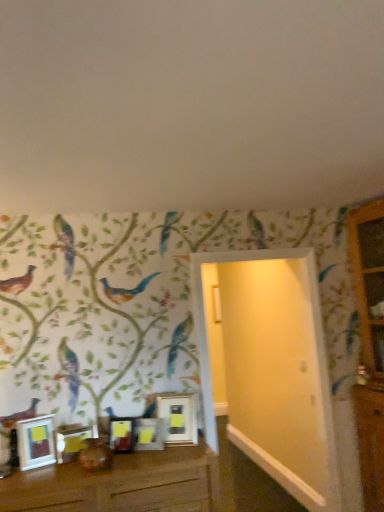
Question: Which direction should I rotate to look at metallic silver picture frame at center, the 1th picture frame viewed from the right, — up or down?

Choices:
 (A) down
 (B) up

Answer: (A)

Question: From a real-world perspective, does white glossy picture frame at lower left, acting as the 5th picture frame starting from the right, sit lower than matte brown vase at center?

Choices:
 (A) yes
 (B) no

Answer: (B)

Question: Considering the relative sizes of white glossy picture frame at lower left, the 1th picture frame positioned from the left, and matte brown vase at center in the image provided, is white glossy picture frame at lower left, the 1th picture frame positioned from the left, bigger than matte brown vase at center?

Choices:
 (A) yes
 (B) no

Answer: (A)

Question: Considering the relative sizes of white glossy picture frame at lower left, acting as the 5th picture frame starting from the right, and matte brown vase at center in the image provided, is white glossy picture frame at lower left, acting as the 5th picture frame starting from the right, smaller than matte brown vase at center?

Choices:
 (A) no
 (B) yes

Answer: (A)

Question: From the image's perspective, is white glossy picture frame at lower left, the 1th picture frame positioned from the left, below matte brown vase at center?

Choices:
 (A) yes
 (B) no

Answer: (B)

Question: Is matte brown vase at center at the back of white glossy picture frame at lower left, the 1th picture frame positioned from the left?

Choices:
 (A) no
 (B) yes

Answer: (A)

Question: Is white glossy picture frame at lower left, the 1th picture frame positioned from the left, not within matte brown vase at center?

Choices:
 (A) yes
 (B) no

Answer: (A)

Question: Considering the relative sizes of matte silver picture frame at center, which is the 3th picture frame in right-to-left order, and metallic silver frame at center, which ranks as the 4th picture frame in left-to-right order, in the image provided, is matte silver picture frame at center, which is the 3th picture frame in right-to-left order, smaller than metallic silver frame at center, which ranks as the 4th picture frame in left-to-right order,?

Choices:
 (A) yes
 (B) no

Answer: (B)

Question: Considering the relative positions of matte silver picture frame at center, arranged as the 3th picture frame when viewed from the left, and metallic silver frame at center, which ranks as the 4th picture frame in left-to-right order, in the image provided, is matte silver picture frame at center, arranged as the 3th picture frame when viewed from the left, to the right of metallic silver frame at center, which ranks as the 4th picture frame in left-to-right order, from the viewer's perspective?

Choices:
 (A) no
 (B) yes

Answer: (A)

Question: Is matte silver picture frame at center, arranged as the 3th picture frame when viewed from the left, located outside metallic silver frame at center, which ranks as the 4th picture frame in left-to-right order?

Choices:
 (A) yes
 (B) no

Answer: (A)

Question: Does matte silver picture frame at center, which is the 3th picture frame in right-to-left order, have a greater width compared to metallic silver frame at center, which ranks as the 4th picture frame in left-to-right order?

Choices:
 (A) no
 (B) yes

Answer: (B)

Question: Does matte silver picture frame at center, which is the 3th picture frame in right-to-left order, have a larger size compared to metallic silver frame at center, which ranks as the 4th picture frame in left-to-right order?

Choices:
 (A) no
 (B) yes

Answer: (B)

Question: Does matte silver picture frame at center, arranged as the 3th picture frame when viewed from the left, have a greater height compared to metallic silver frame at center, which ranks as the 4th picture frame in left-to-right order?

Choices:
 (A) yes
 (B) no

Answer: (B)

Question: Is metallic silver picture frame at center, the fifth picture frame when ordered from left to right, inside matte silver picture frame at lower left, which ranks as the second picture frame in left-to-right order?

Choices:
 (A) no
 (B) yes

Answer: (A)